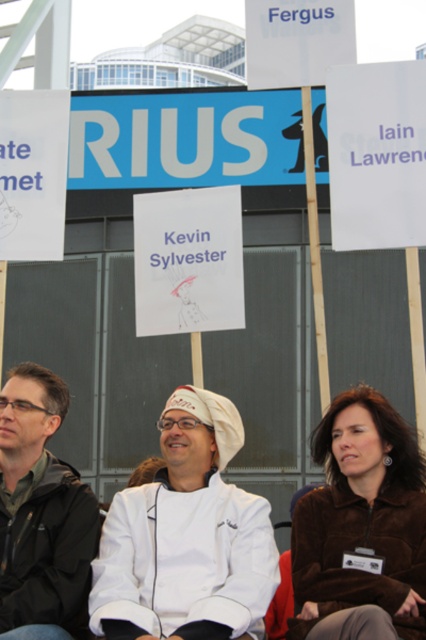
You are at an outdoor event and see the white matte chef coat at center and the brown fuzzy jacket at lower right. Which one is positioned more to the left?

The white matte chef coat at center is positioned more to the left than the brown fuzzy jacket at lower right.

You are standing at the center of the scene and want to walk towards both the point at coordinates point (169, 582) and the point at coordinates point (321, 38). Which point will you reach first?

Since point (169, 582) is closer to the camera than point (321, 38), you will reach point (169, 582) first.

In the scene shown: You are planning to take a photo of the white matte chef coat at center and the white paper sign at upper center. Which object should you focus on first if you want to capture both in the frame without moving the camera?

You should focus on the white matte chef coat at center first because its width is larger than the white paper sign at upper center, so it will require more space in the frame.